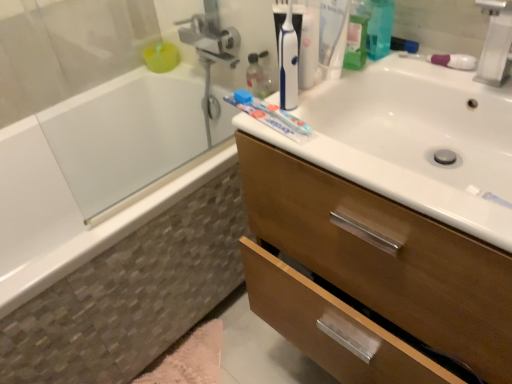
Question: From a real-world perspective, is white glossy sink at upper right on brown wood cabinet at upper center?

Choices:
 (A) yes
 (B) no

Answer: (A)

Question: Considering the relative sizes of white glossy sink at upper right and brown wood cabinet at upper center in the image provided, is white glossy sink at upper right shorter than brown wood cabinet at upper center?

Choices:
 (A) yes
 (B) no

Answer: (A)

Question: Is white glossy sink at upper right positioned beyond the bounds of brown wood cabinet at upper center?

Choices:
 (A) no
 (B) yes

Answer: (A)

Question: Is white glossy sink at upper right looking in the opposite direction of brown wood cabinet at upper center?

Choices:
 (A) no
 (B) yes

Answer: (B)

Question: From the image's perspective, does white glossy sink at upper right appear lower than brown wood cabinet at upper center?

Choices:
 (A) no
 (B) yes

Answer: (A)

Question: Does white glossy sink at upper right have a greater width compared to brown wood cabinet at upper center?

Choices:
 (A) no
 (B) yes

Answer: (A)

Question: Does white plastic faucet at upper right contain pink fluffy bath mat at lower left?

Choices:
 (A) yes
 (B) no

Answer: (B)

Question: From a real-world perspective, does white plastic faucet at upper right stand above pink fluffy bath mat at lower left?

Choices:
 (A) yes
 (B) no

Answer: (A)

Question: From a real-world perspective, is white plastic faucet at upper right beneath pink fluffy bath mat at lower left?

Choices:
 (A) no
 (B) yes

Answer: (A)

Question: Can you confirm if white plastic faucet at upper right is taller than pink fluffy bath mat at lower left?

Choices:
 (A) yes
 (B) no

Answer: (A)

Question: Does white plastic faucet at upper right have a lesser height compared to pink fluffy bath mat at lower left?

Choices:
 (A) yes
 (B) no

Answer: (B)

Question: Is white plastic faucet at upper right wider than pink fluffy bath mat at lower left?

Choices:
 (A) no
 (B) yes

Answer: (A)

Question: Is white frosted glass bathtub at left, which is the 2th bath in bottom-to-top order, shorter than white plastic faucet at upper right?

Choices:
 (A) yes
 (B) no

Answer: (B)